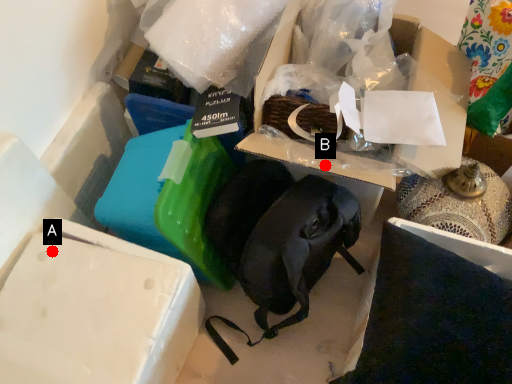
Question: Two points are circled on the image, labeled by A and B beside each circle. Which of the following is the farthest from the observer?

Choices:
 (A) A is further
 (B) B is further

Answer: (A)